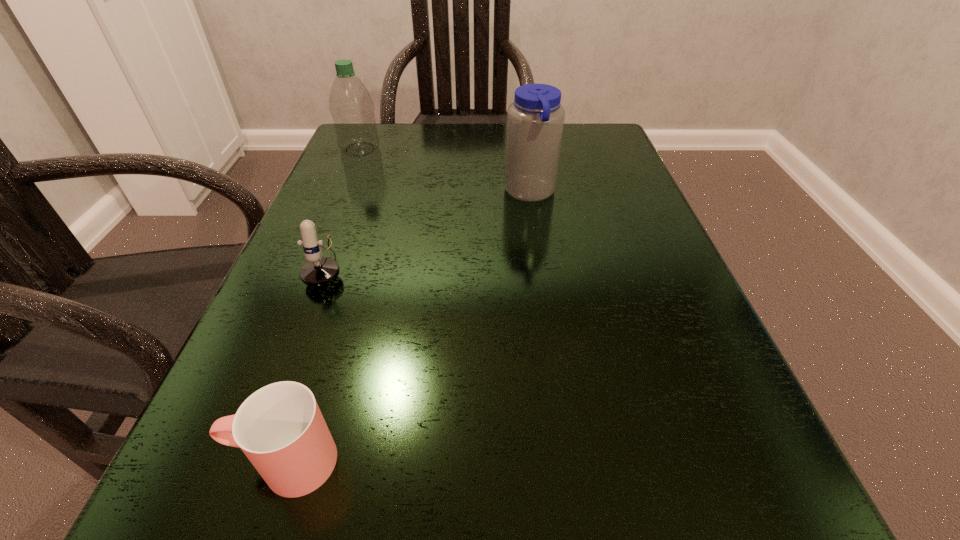
Find the location of a particular element. Image resolution: width=960 pixels, height=540 pixels. blank region between the cup and the microphone is located at coordinates (307, 362).

Where is `free area in between the rightmost object and the farthest object`? free area in between the rightmost object and the farthest object is located at coordinates (445, 171).

Where is `vacant space in between the nearest object and the rightmost object`? Image resolution: width=960 pixels, height=540 pixels. vacant space in between the nearest object and the rightmost object is located at coordinates (408, 327).

Locate an element on the screen. Image resolution: width=960 pixels, height=540 pixels. free space between the farther water bottle and the right water bottle is located at coordinates (445, 171).

Locate an element on the screen. Image resolution: width=960 pixels, height=540 pixels. the closest object to the right water bottle is located at coordinates (318, 271).

Locate which object is the closest to the left water bottle. Please provide its 2D coordinates. Your answer should be formatted as a tuple, i.e. [(x, y)], where the tuple contains the x and y coordinates of a point satisfying the conditions above.

[(318, 271)]

You are a GUI agent. You are given a task and a screenshot of the screen. Output one action in this format:
    pyautogui.click(x=<x>, y=<y>)
    Task: Click on the free point that satisfies the following two spatial constraints: 1. on the front side of the microphone; 2. on the side of the cup with the handle
    
    Given the screenshot: What is the action you would take?
    pyautogui.click(x=253, y=462)